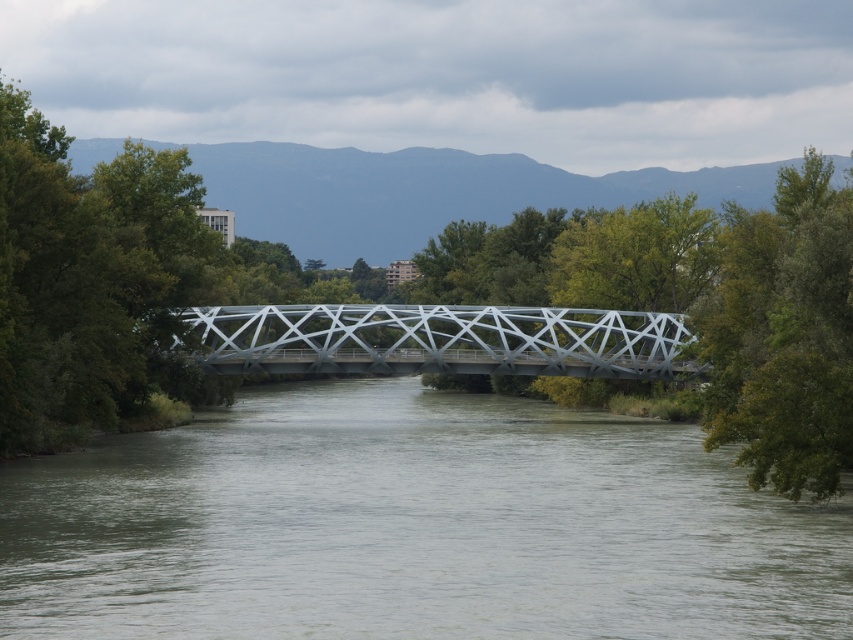
You are a bird looking for a nesting spot. You want to choose the taller tree between the green leafy tree at left and the green leafy tree at right. Which one should you choose?

The green leafy tree at right is taller than the green leafy tree at left, so you should choose the green leafy tree at right for nesting.